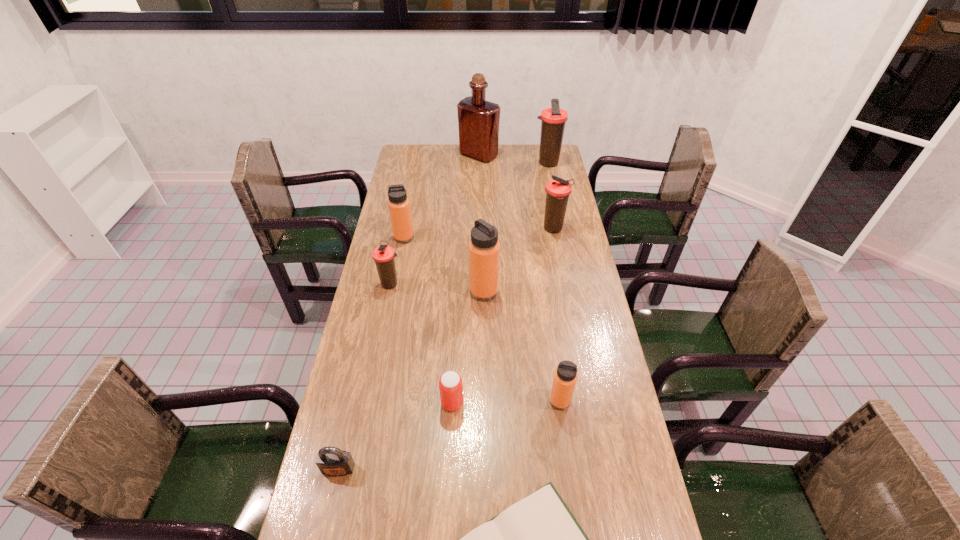
This screenshot has width=960, height=540. In order to click on vacant space at the left edge in this screenshot , I will do `click(417, 180)`.

Identify the location of free space at the right edge of the desktop. (564, 231).

Identify the location of free space that is in between the second farthest brown thermos bottle and the tallest object. (516, 192).

This screenshot has height=540, width=960. Find the location of `vacant area that lies between the second biggest brown thermos bottle and the gray padlock`. vacant area that lies between the second biggest brown thermos bottle and the gray padlock is located at coordinates (446, 349).

Locate an element on the screen. This screenshot has width=960, height=540. vacant space that is in between the red beer can and the smallest brown thermos bottle is located at coordinates (421, 343).

Where is `vacant region between the tallest object and the nearest orange thermos bottle`? This screenshot has height=540, width=960. vacant region between the tallest object and the nearest orange thermos bottle is located at coordinates (519, 278).

Where is `vacant space in between the brown liquor and the second smallest brown thermos bottle`? vacant space in between the brown liquor and the second smallest brown thermos bottle is located at coordinates 516,192.

The width and height of the screenshot is (960, 540). In order to click on vacant space that is in between the gray padlock and the red beer can in this screenshot , I will do `click(396, 436)`.

This screenshot has width=960, height=540. I want to click on object that can be found as the ninth closest to the second orange thermos bottle from right to left, so tap(478, 120).

The height and width of the screenshot is (540, 960). I want to click on the fifth closest object to the brown liquor, so click(x=484, y=248).